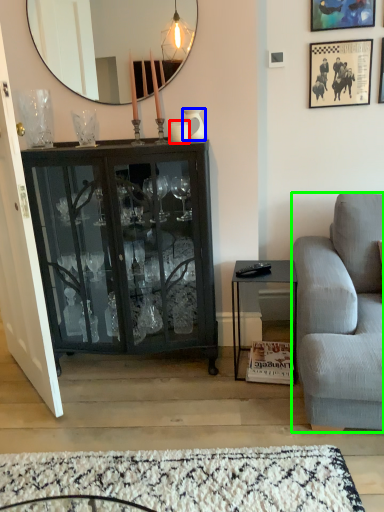
Question: Which object is the closest to the coffee cup (highlighted by a red box)? Choose among these: vase (highlighted by a blue box) or studio couch (highlighted by a green box).

Choices:
 (A) vase
 (B) studio couch

Answer: (A)